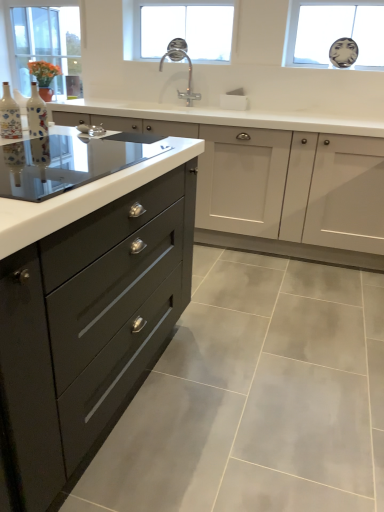
Question: Is clear glass faucet at upper center, the second window viewed from the left, at the right side of polished chrome faucet at center?

Choices:
 (A) yes
 (B) no

Answer: (A)

Question: From the image's perspective, does clear glass faucet at upper center, the 2th window viewed from the right, appear lower than polished chrome faucet at center?

Choices:
 (A) no
 (B) yes

Answer: (A)

Question: Is clear glass faucet at upper center, the 2th window viewed from the right, smaller than polished chrome faucet at center?

Choices:
 (A) no
 (B) yes

Answer: (A)

Question: Is clear glass faucet at upper center, the 2th window viewed from the right, aimed at polished chrome faucet at center?

Choices:
 (A) no
 (B) yes

Answer: (A)

Question: Is clear glass faucet at upper center, the second window viewed from the left, at the left side of polished chrome faucet at center?

Choices:
 (A) yes
 (B) no

Answer: (B)

Question: Is polished chrome faucet at center at the back of clear glass faucet at upper center, the 2th window viewed from the right?

Choices:
 (A) no
 (B) yes

Answer: (A)

Question: Can you confirm if decorative ceramic vase at left, the 1th bottle from the right, is wider than clear glass window at upper left, the 3th window in the right-to-left sequence?

Choices:
 (A) no
 (B) yes

Answer: (A)

Question: From a real-world perspective, is decorative ceramic vase at left, which is the second bottle in left-to-right order, physically below clear glass window at upper left, the 3th window in the right-to-left sequence?

Choices:
 (A) yes
 (B) no

Answer: (A)

Question: Is decorative ceramic vase at left, the 1th bottle from the right, positioned beyond the bounds of clear glass window at upper left, which appears as the first window when viewed from the left?

Choices:
 (A) no
 (B) yes

Answer: (B)

Question: Does decorative ceramic vase at left, which is the second bottle in left-to-right order, have a lesser height compared to clear glass window at upper left, the 3th window in the right-to-left sequence?

Choices:
 (A) yes
 (B) no

Answer: (A)

Question: Is decorative ceramic vase at left, which is the second bottle in left-to-right order, surrounding clear glass window at upper left, which appears as the first window when viewed from the left?

Choices:
 (A) yes
 (B) no

Answer: (B)

Question: Is decorative ceramic vase at left, the 1th bottle from the right, further to the viewer compared to clear glass window at upper left, which appears as the first window when viewed from the left?

Choices:
 (A) yes
 (B) no

Answer: (B)

Question: From a real-world perspective, is clear glass window at upper left, the 3th window in the right-to-left sequence, physically below matte ceramic vase at left, which appears as the 1th bottle when viewed from the left?

Choices:
 (A) yes
 (B) no

Answer: (B)